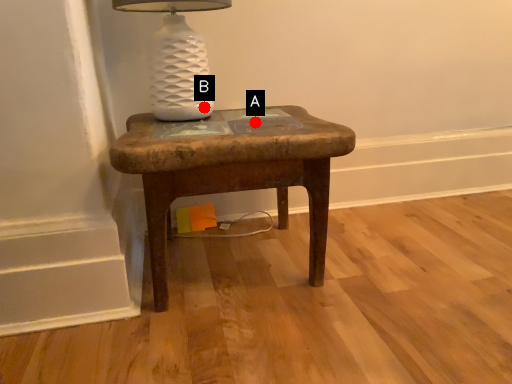
Question: Two points are circled on the image, labeled by A and B beside each circle. Which of the following is the farthest from the observer?

Choices:
 (A) A is further
 (B) B is further

Answer: (B)